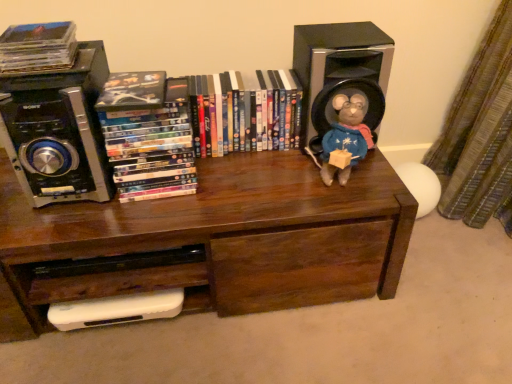
This screenshot has height=384, width=512. Find the location of `free space to the left of fuzzy fabric stuffed animal at upper right`. free space to the left of fuzzy fabric stuffed animal at upper right is located at coordinates (280, 176).